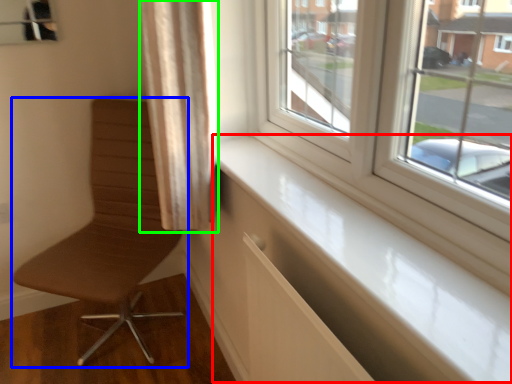
Question: Which object is the closest to the window sill (highlighted by a red box)? Choose among these: chair (highlighted by a blue box) or curtain (highlighted by a green box).

Choices:
 (A) chair
 (B) curtain

Answer: (B)